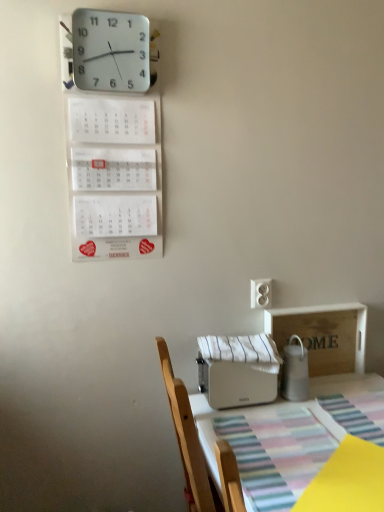
Find the location of a particular element. empty space that is ontop of white plastic toaster at lower center (from a real-world perspective) is located at coordinates (314, 428).